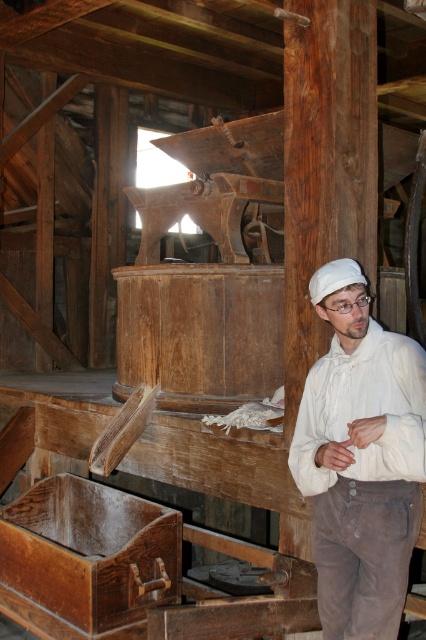
Who is taller, white cotton shirt at center or white fabric cap at center?

With more height is white cotton shirt at center.

Can you confirm if white cotton shirt at center is positioned below white fabric cap at center?

Correct, white cotton shirt at center is located below white fabric cap at center.

The image size is (426, 640). What are the coordinates of `white cotton shirt at center` in the screenshot? It's located at (360, 460).

Which is above, wooden crate at lower left or white fabric cap at center?

Result: white fabric cap at center is above.

Does wooden crate at lower left have a smaller size compared to white fabric cap at center?

Actually, wooden crate at lower left might be larger than white fabric cap at center.

Identify the location of wooden crate at lower left. The image size is (426, 640). coord(86,557).

Is white cotton shirt at center to the left of wooden crate at lower left from the viewer's perspective?

No, white cotton shirt at center is not to the left of wooden crate at lower left.

Does white cotton shirt at center have a greater height compared to wooden crate at lower left?

Correct, white cotton shirt at center is much taller as wooden crate at lower left.

Describe the element at coordinates (360, 460) in the screenshot. The width and height of the screenshot is (426, 640). I see `white cotton shirt at center` at that location.

Locate an element on the screen. white cotton shirt at center is located at coordinates (360, 460).